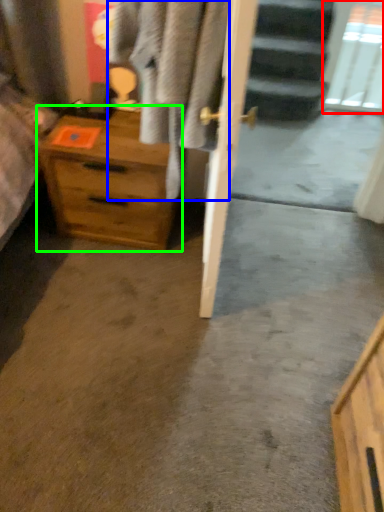
Question: Estimate the real-world distances between objects in this image. Which object is farther from glass door (highlighted by a red box), clothing (highlighted by a blue box) or chest of drawers (highlighted by a green box)?

Choices:
 (A) clothing
 (B) chest of drawers

Answer: (A)